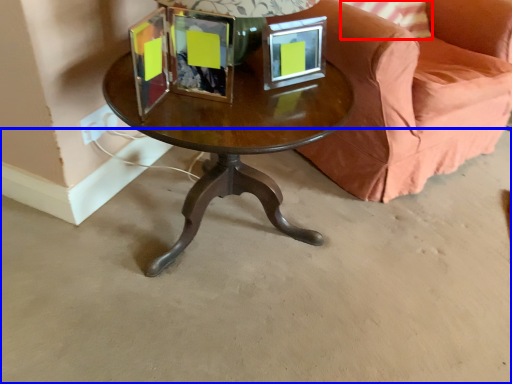
Question: Which point is closer to the camera, pillow (highlighted by a red box) or concrete (highlighted by a blue box)?

Choices:
 (A) pillow
 (B) concrete

Answer: (B)